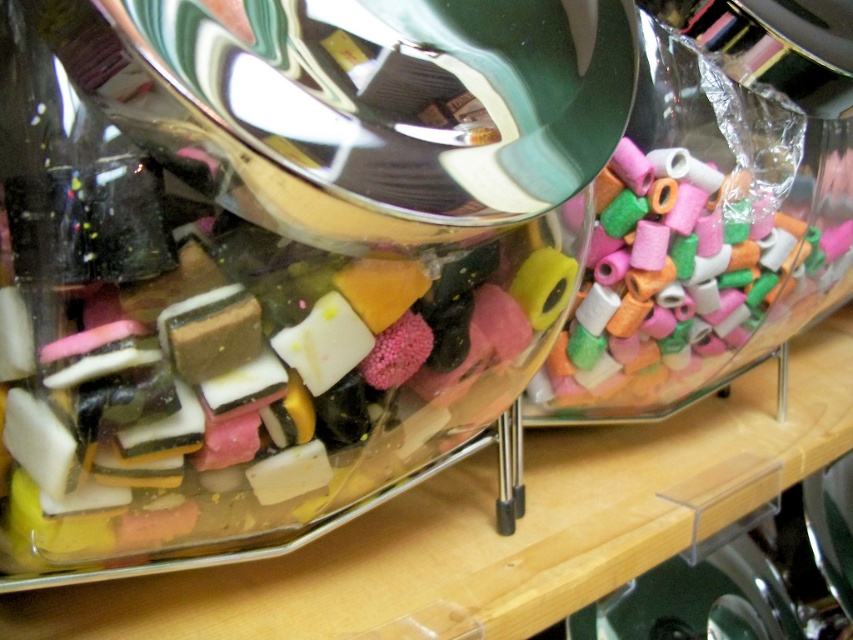
Question: Does translucent glass candy at center lie behind translucent plastic beads at right?

Choices:
 (A) yes
 (B) no

Answer: (B)

Question: Does translucent glass candy at center come behind translucent plastic beads at right?

Choices:
 (A) no
 (B) yes

Answer: (A)

Question: Which point appears farthest from the camera in this image?

Choices:
 (A) (245, 289)
 (B) (685, 164)

Answer: (B)

Question: Which of the following is the farthest from the observer?

Choices:
 (A) translucent glass candy at center
 (B) translucent plastic beads at right

Answer: (B)

Question: Is translucent glass candy at center positioned behind translucent plastic beads at right?

Choices:
 (A) yes
 (B) no

Answer: (B)